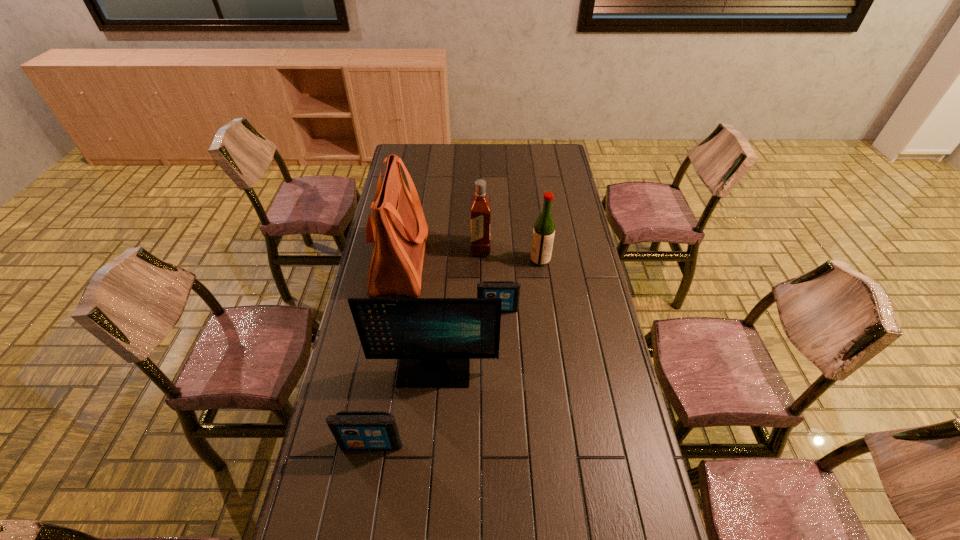
The width and height of the screenshot is (960, 540). I want to click on monitor present at the left edge, so click(x=434, y=339).

Identify the location of vacant space at the far edge of the desktop. (499, 166).

This screenshot has width=960, height=540. I want to click on free space at the left edge, so click(418, 191).

The image size is (960, 540). Find the location of `vacant region at the right edge of the desktop`. vacant region at the right edge of the desktop is located at coordinates (548, 168).

Locate an element on the screen. free space at the far left corner is located at coordinates (419, 159).

Locate an element on the screen. unoccupied area between the shorter iPod and the shopping bag is located at coordinates click(x=449, y=286).

Identify the location of unoccupied position between the left liquor and the rightmost object. Image resolution: width=960 pixels, height=540 pixels. (511, 254).

Where is `empty location between the right liquor and the shopping bag`? The height and width of the screenshot is (540, 960). empty location between the right liquor and the shopping bag is located at coordinates (470, 261).

Point out which object is positioned as the fifth nearest to the fifth tallest object. Please provide its 2D coordinates. Your answer should be formatted as a tuple, i.e. [(x, y)], where the tuple contains the x and y coordinates of a point satisfying the conditions above.

[(544, 228)]

Locate an element on the screen. The height and width of the screenshot is (540, 960). object identified as the fifth closest to the right liquor is located at coordinates (353, 430).